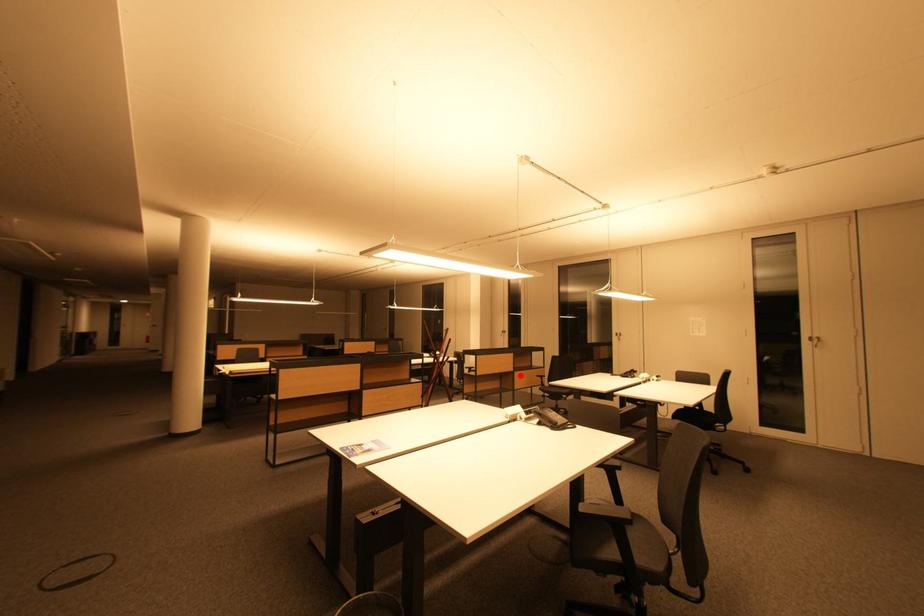
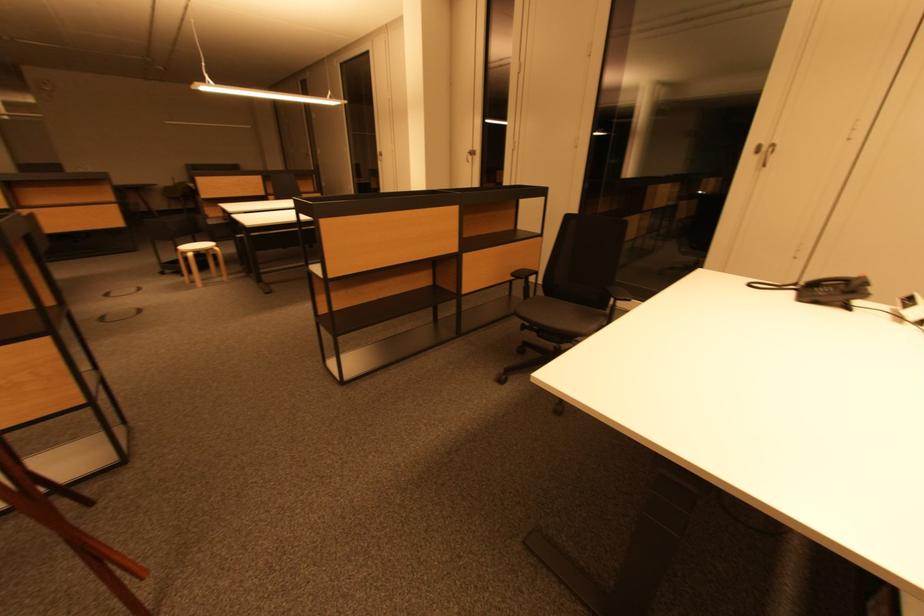
Question: I am providing you with two images of the same scene from different viewpoints. Given a red point in image1, look at the same physical point in image2. Is it:

Choices:
 (A) Closer to the viewpoint
 (B) Farther from the viewpoint

Answer: (A)